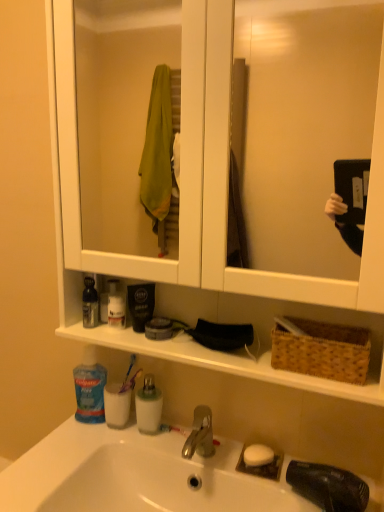
Question: Visually, is white glossy sink at lower center positioned to the left or to the right of brown woven basket at right?

Choices:
 (A) right
 (B) left

Answer: (B)

Question: In terms of height, does white glossy sink at lower center look taller or shorter compared to brown woven basket at right?

Choices:
 (A) tall
 (B) short

Answer: (A)

Question: Which object is positioned farthest from the blue translucent mouthwash at center, acting as the 1th mouthwash starting from the top?

Choices:
 (A) purple plastic toothbrush at lower center
 (B) white matte soap at center
 (C) white opaque cup at lower left, acting as the 2th mouthwash starting from the top
 (D) white glossy sink at lower center
 (E) blue plastic toothpaste at lower left

Answer: (B)

Question: Considering the real-world distances, which object is farthest from the purple plastic toothbrush at lower center?

Choices:
 (A) blue translucent mouthwash at center, acting as the 1th mouthwash starting from the top
 (B) white glossy sink at lower center
 (C) white matte soap at center
 (D) white opaque cup at lower left, the first mouthwash from the bottom
 (E) brown woven basket at right

Answer: (E)